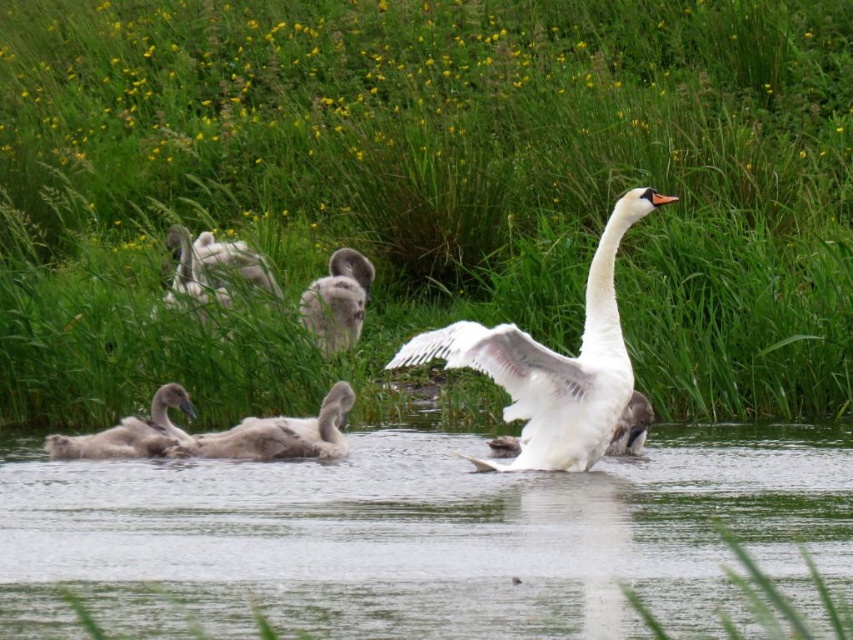
Is white glossy swan at center bigger than gray downy duckling at upper left?

Correct, white glossy swan at center is larger in size than gray downy duckling at upper left.

Is white glossy swan at center shorter than gray downy duckling at upper left?

No, white glossy swan at center is not shorter than gray downy duckling at upper left.

Identify the location of white glossy swan at center. (553, 364).

Does clear water at center have a lesser height compared to gray downy gosling at center?

Yes.

Who is higher up, clear water at center or gray downy gosling at center?

gray downy gosling at center is above.

Looking at this image, who is more distant from viewer, (688, 518) or (233, 433)?

Positioned behind is point (233, 433).

In order to click on clear water at center in this screenshot , I will do `click(421, 536)`.

Is clear water at center above white matte duck at center?

No, clear water at center is not above white matte duck at center.

Is clear water at center to the right of white matte duck at center from the viewer's perspective?

No, clear water at center is not to the right of white matte duck at center.

Locate an element on the screen. The width and height of the screenshot is (853, 640). clear water at center is located at coordinates (421, 536).